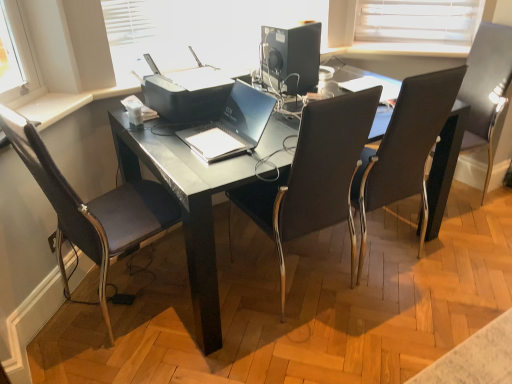
This screenshot has height=384, width=512. I want to click on vacant area to the right of dark brown leather chair at left, positioned as the 1th chair in left-to-right order, so click(x=220, y=302).